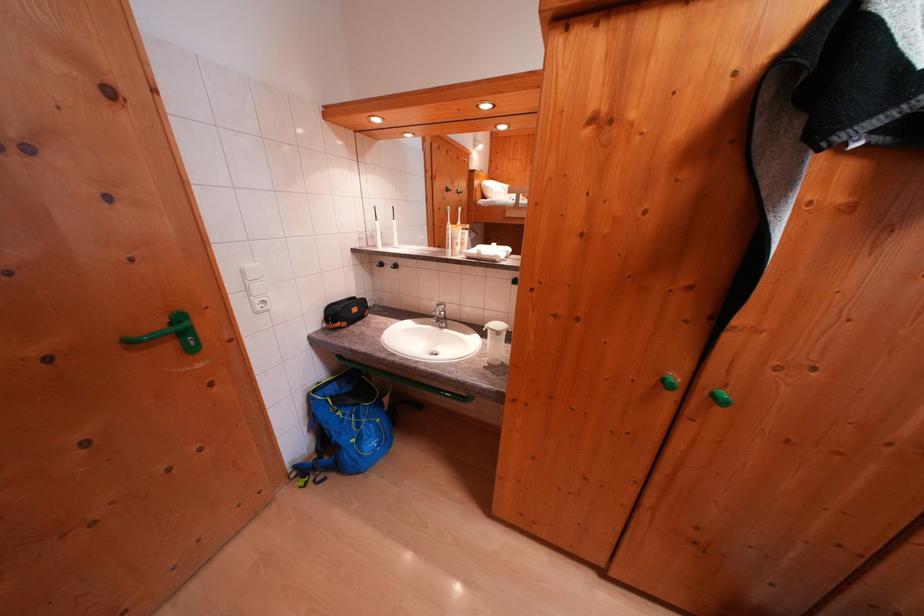
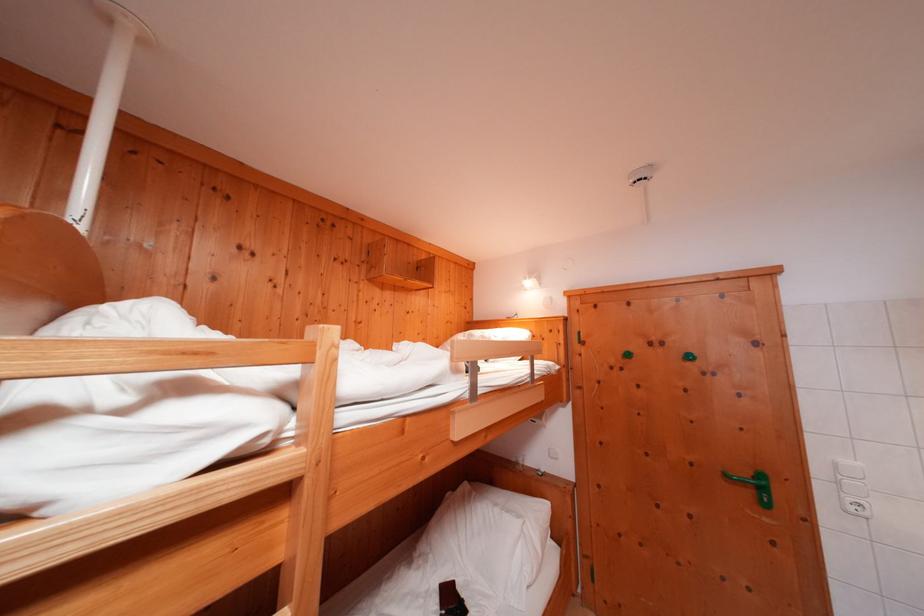
In the second image, find the point that corresponds to point 266,313 in the first image.

(858, 513)